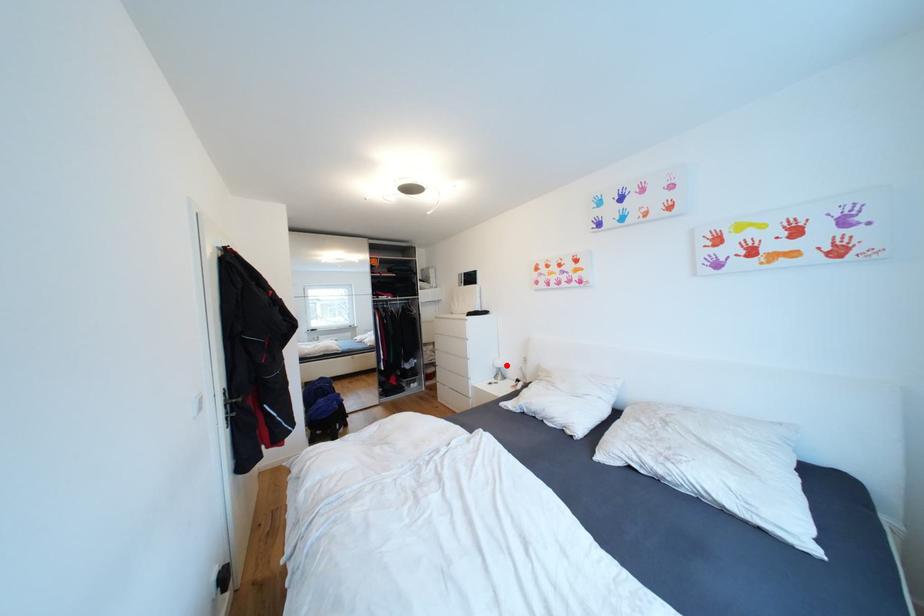
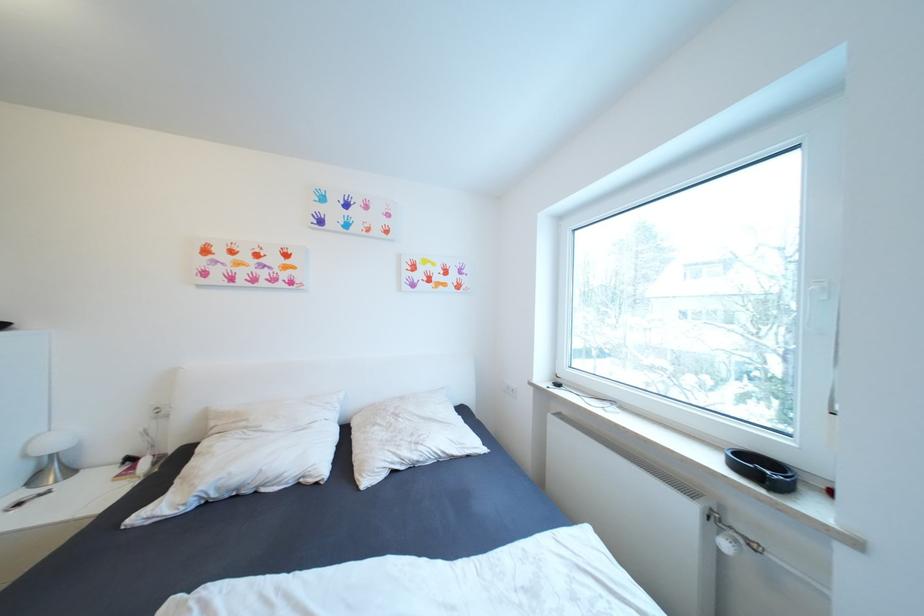
Locate, in the second image, the point that corresponds to the highlighted location in the first image.

(63, 445)